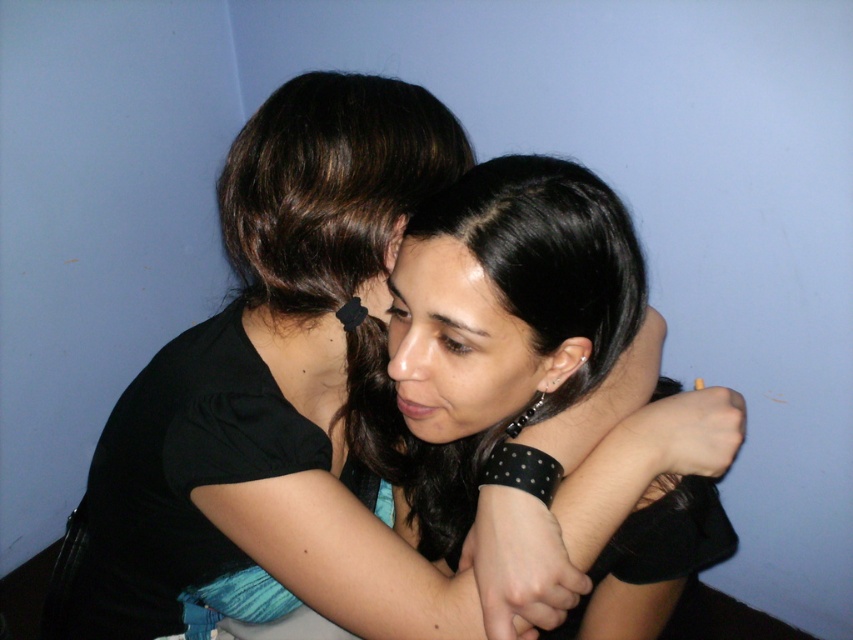
You are a photographer adjusting the focus of your camera. You want to capture both the black dotted bracelet at center and the smooth skin forehead at center in sharp detail. Given the camera can only focus on objects within 5 inches of each other, will both subjects be in focus?

The black dotted bracelet at center is 5.52 inches from the smooth skin forehead at center. Since the distance exceeds the camera focus range of 5 inches, both subjects cannot be in focus simultaneously.

You are a photographer adjusting the focus of your camera. You need to decide whether to focus on the black matte shirt at center or the black dotted bracelet at center. Given their distance apart, will the focus on one likely blur the other? Please explain based on their separation.

The black matte shirt at center and black dotted bracelet at center are 4.78 inches apart. At this distance, if focusing on one, the other may appear slightly out of focus depending on the camera settings like aperture. A smaller aperture would keep both in focus, while a larger aperture might blur the bracelet or shirt depending on which is in focus.

You are a photographer adjusting the lighting in a studio. You notice the black matte shirt at center and the smooth skin forehead at center in the frame. Which object should you focus your light on to ensure proper exposure, considering their sizes?

The black matte shirt at center is bigger than the smooth skin forehead at center, so focusing the light on the black matte shirt at center would ensure proper exposure due to its larger size.